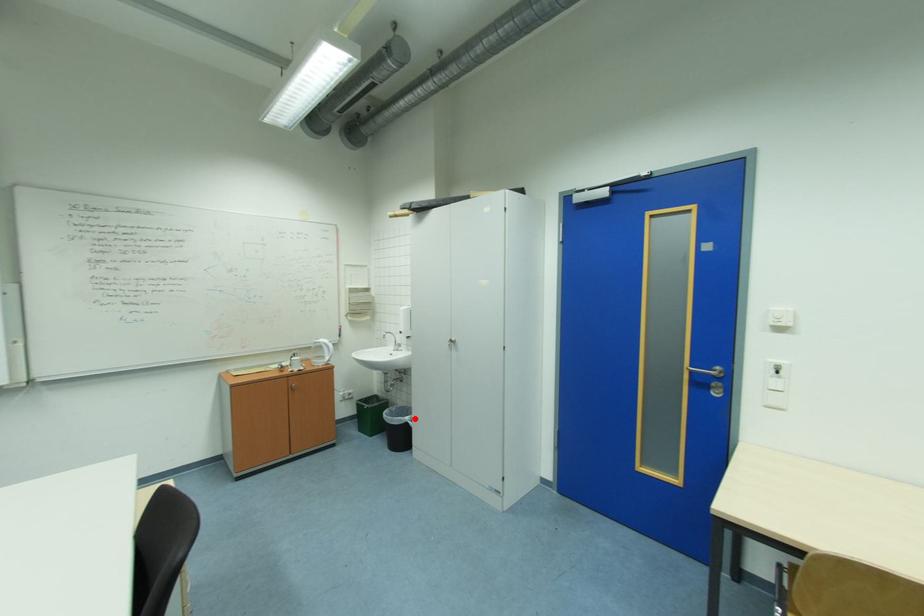
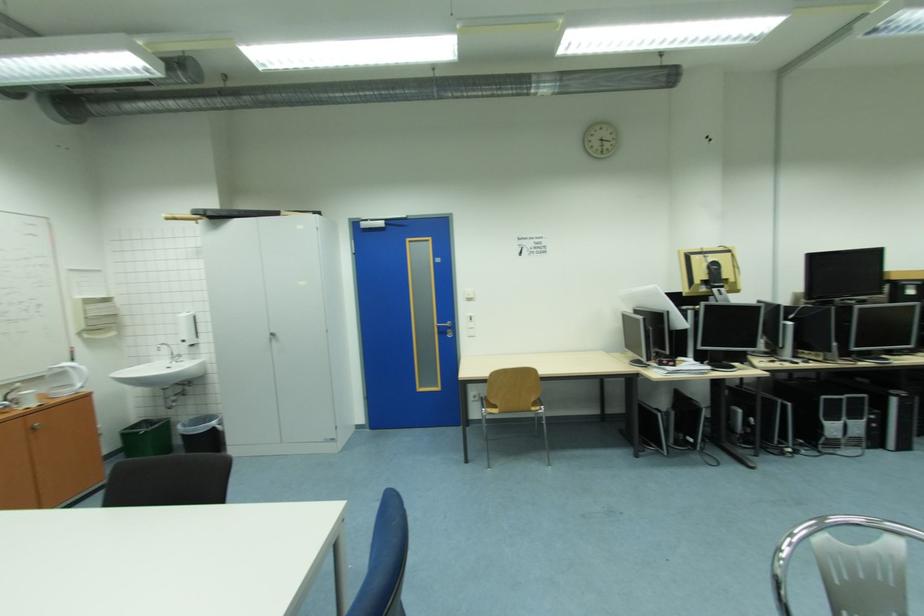
Question: I am providing you with two images of the same scene from different viewpoints. A red point is shown in image1. For the corresponding object point in image2, is it positioned nearer or farther from the camera?

Choices:
 (A) Nearer
 (B) Farther

Answer: (A)